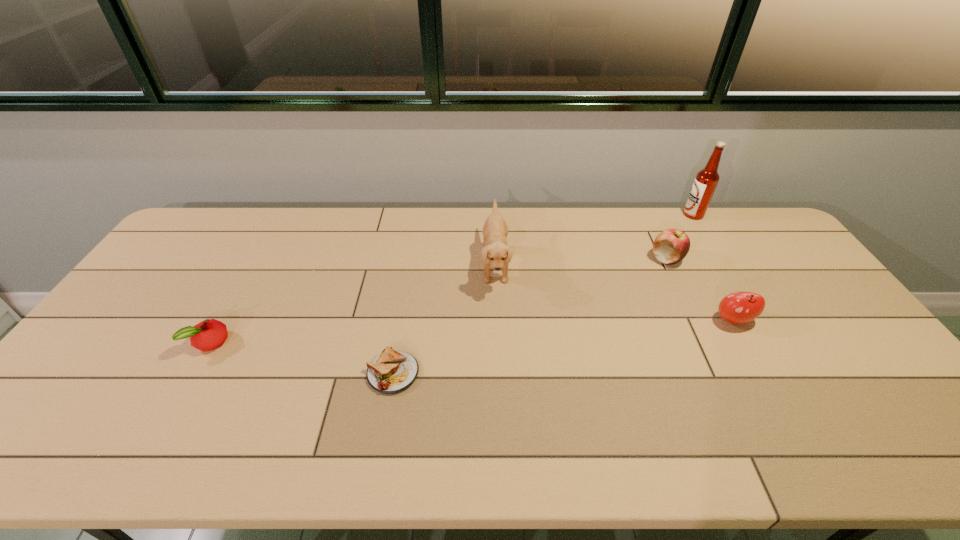
Image resolution: width=960 pixels, height=540 pixels. In order to click on free spot between the shortest object and the tallest object in this screenshot , I will do `click(543, 294)`.

At what (x,y) coordinates should I click in order to perform the action: click on object that ranks as the second closest to the tallest object. Please return your answer as a coordinate pair (x, y). The image size is (960, 540). Looking at the image, I should click on (740, 307).

Select which object appears as the third closest to the third object from left to right. Please provide its 2D coordinates. Your answer should be formatted as a tuple, i.e. [(x, y)], where the tuple contains the x and y coordinates of a point satisfying the conditions above.

[(740, 307)]

Image resolution: width=960 pixels, height=540 pixels. What are the coordinates of `apple that stands as the closest to the shortest object` in the screenshot? It's located at [x=209, y=334].

Identify which apple is the second closest to the shortest apple. Please provide its 2D coordinates. Your answer should be formatted as a tuple, i.e. [(x, y)], where the tuple contains the x and y coordinates of a point satisfying the conditions above.

[(740, 307)]

In order to click on free space in the image that satisfies the following two spatial constraints: 1. on the back side of the farthest apple; 2. on the left side of the shortest object in this screenshot , I will do `click(413, 259)`.

Find the location of `free point that satisfies the following two spatial constraints: 1. on the front side of the farthest apple; 2. on the left side of the puppy`. free point that satisfies the following two spatial constraints: 1. on the front side of the farthest apple; 2. on the left side of the puppy is located at coordinates (669, 265).